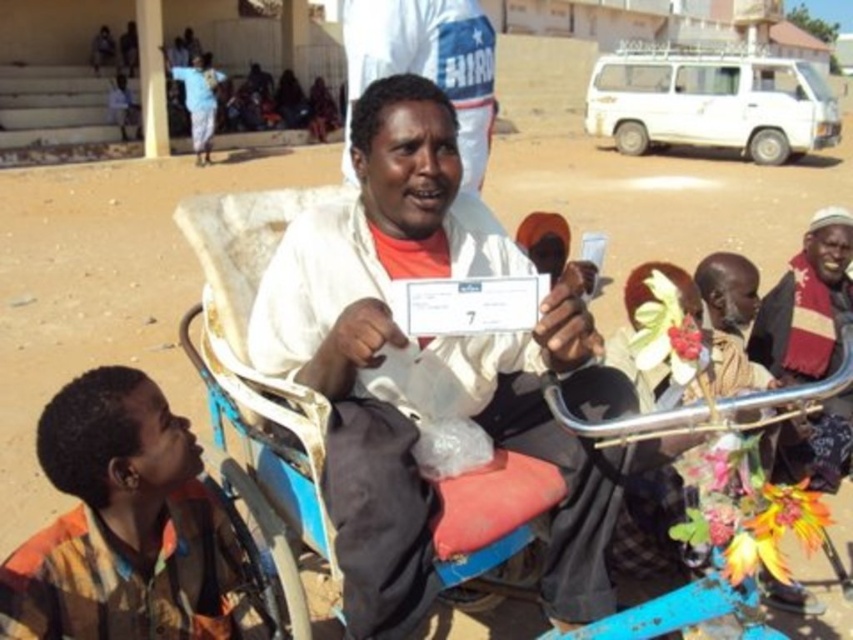
You are a photographer trying to capture a group photo of the white matte shirt at center and the multicolored fabric shirt at lower left. Since you want both subjects to appear equally tall in the photo, which adjustment should you make?

Since the white matte shirt at center is taller than the multicolored fabric shirt at lower left, you should position the camera lower to reduce the apparent height difference between them, making both subjects appear equally tall in the photo.

You are standing at the origin of a coordinate system placed at the bottom left corner of the image. You see a man in a wheelchair holding a document with the number 7 and a point marked at coordinates (120, 524). What object is located at that point?

The point at coordinates (120, 524) marks the multicolored fabric shirt at lower left.

Based on the photo, you are a delivery person who needs to place a package on the blue metallic cart at center. However, there is a multicolored fabric shirt at lower left in the way. Can you move the package over the shirt to the cart?

The multicolored fabric shirt at lower left is positioned under the blue metallic cart at center, so the shirt is directly below the cart. This means you can place the package directly onto the cart without needing to move the shirt as it is already underneath.